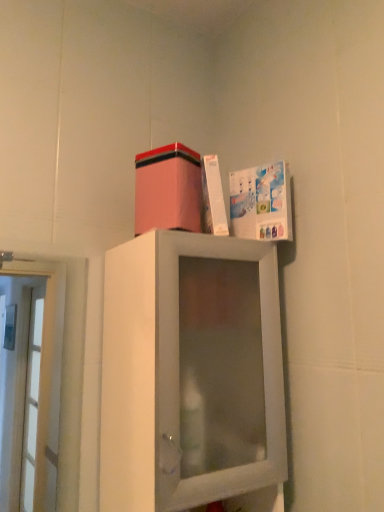
Question: From a real-world perspective, is white matte cabinet at upper center physically below pink matte cardboard box at upper center?

Choices:
 (A) no
 (B) yes

Answer: (B)

Question: Is there a large distance between white matte cabinet at upper center and pink matte cardboard box at upper center?

Choices:
 (A) yes
 (B) no

Answer: (B)

Question: Is white matte cabinet at upper center positioned in front of pink matte cardboard box at upper center?

Choices:
 (A) yes
 (B) no

Answer: (A)

Question: Can you confirm if white matte cabinet at upper center is taller than pink matte cardboard box at upper center?

Choices:
 (A) yes
 (B) no

Answer: (A)

Question: Considering the relative sizes of white matte cabinet at upper center and pink matte cardboard box at upper center in the image provided, is white matte cabinet at upper center smaller than pink matte cardboard box at upper center?

Choices:
 (A) yes
 (B) no

Answer: (B)

Question: Relative to white matte cabinet at upper center, is white glossy book at upper right in front or behind?

Choices:
 (A) behind
 (B) front

Answer: (A)

Question: In terms of size, does white glossy book at upper right appear bigger or smaller than white matte cabinet at upper center?

Choices:
 (A) small
 (B) big

Answer: (A)

Question: From their relative heights in the image, would you say white glossy book at upper right is taller or shorter than white matte cabinet at upper center?

Choices:
 (A) short
 (B) tall

Answer: (A)

Question: Based on their positions, is white glossy book at upper right located to the left or right of white matte cabinet at upper center?

Choices:
 (A) right
 (B) left

Answer: (A)

Question: Based on their sizes in the image, would you say pink matte cardboard box at upper center is bigger or smaller than white matte cabinet at upper center?

Choices:
 (A) big
 (B) small

Answer: (B)

Question: Is point (190, 159) closer or farther from the camera than point (241, 326)?

Choices:
 (A) closer
 (B) farther

Answer: (B)

Question: From a real-world perspective, is pink matte cardboard box at upper center physically located above or below white matte cabinet at upper center?

Choices:
 (A) below
 (B) above

Answer: (B)

Question: Relative to white matte cabinet at upper center, is pink matte cardboard box at upper center in front or behind?

Choices:
 (A) behind
 (B) front

Answer: (A)

Question: From the image's perspective, is white glossy book at upper right located above or below pink matte cardboard box at upper center?

Choices:
 (A) above
 (B) below

Answer: (B)

Question: Would you say white glossy book at upper right is to the left or to the right of pink matte cardboard box at upper center in the picture?

Choices:
 (A) right
 (B) left

Answer: (A)